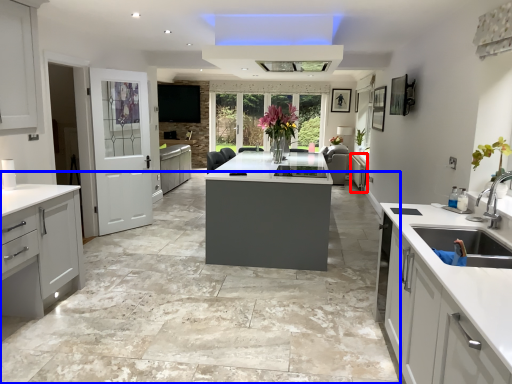
Question: Which object appears farthest to the camera in this image, cabinetry (highlighted by a red box) or concrete (highlighted by a blue box)?

Choices:
 (A) cabinetry
 (B) concrete

Answer: (A)